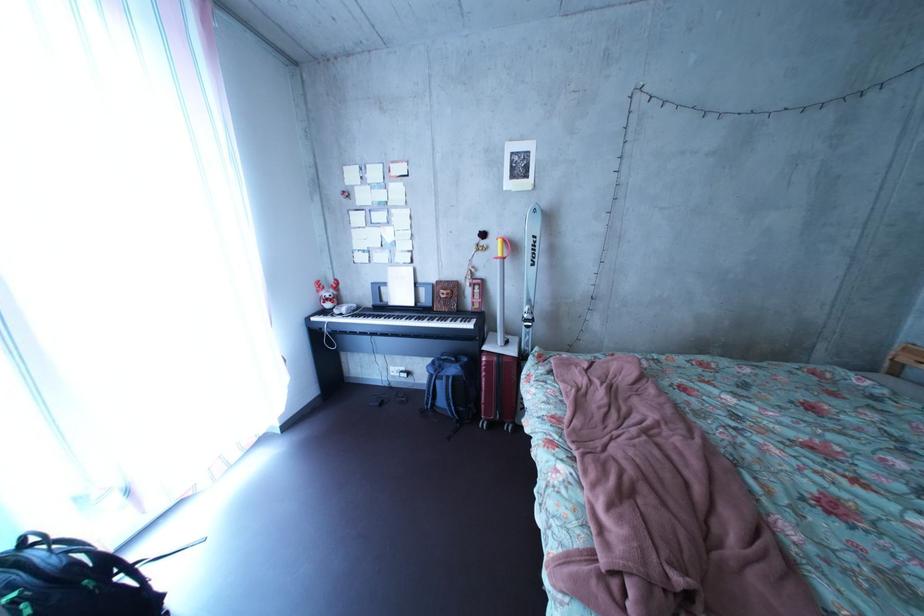
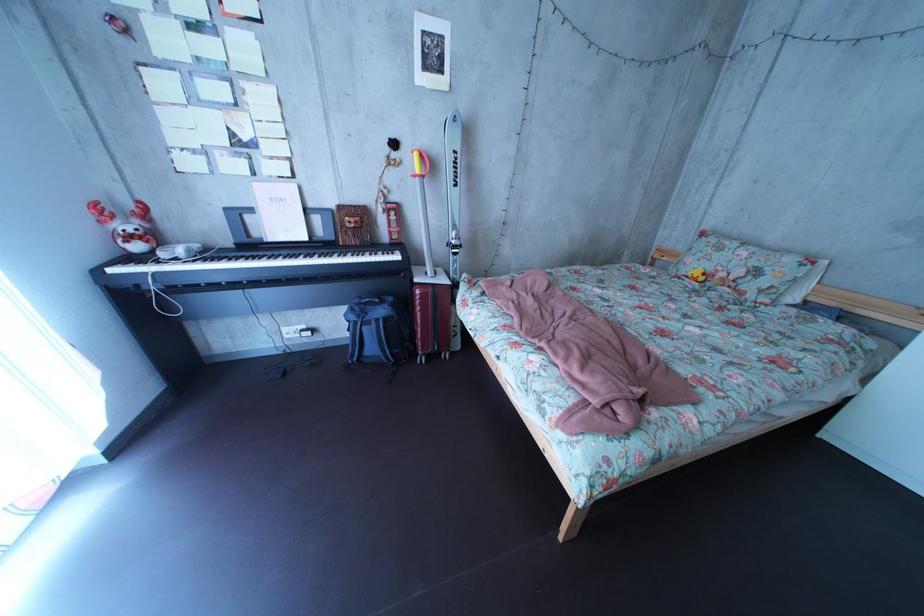
Question: How did the camera likely rotate?

Choices:
 (A) Left
 (B) Right
 (C) Up
 (D) Down

Answer: (B)